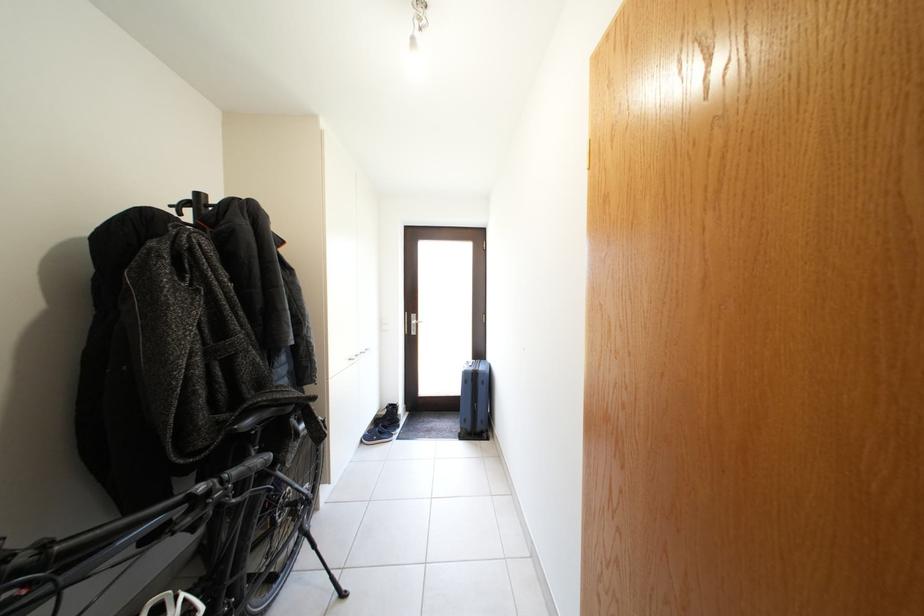
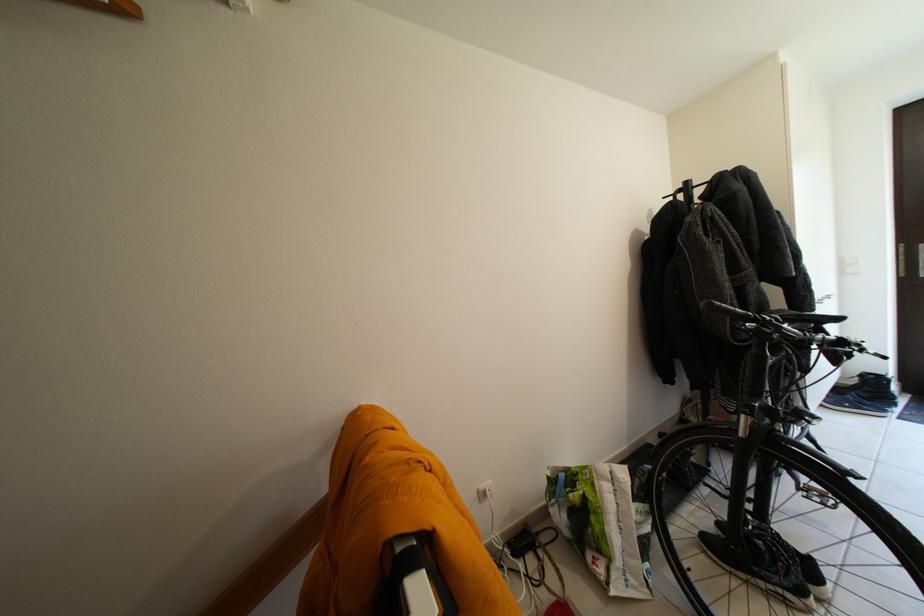
Find the pixel in the second image that matches point (205, 200) in the first image.

(696, 188)